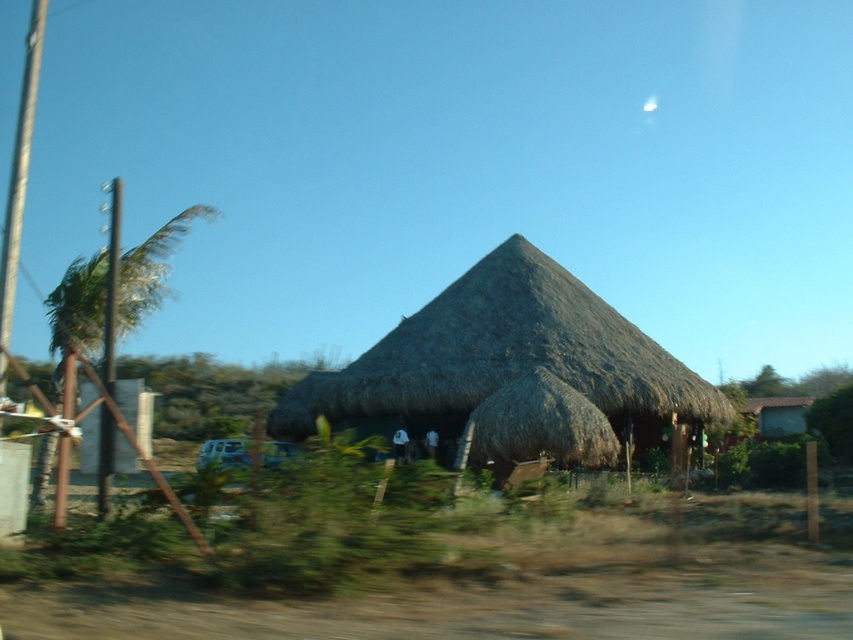
Who is taller, white matte car at lower left or transparent glass car window at center?

Standing taller between the two is white matte car at lower left.

Measure the distance between white matte car at lower left and transparent glass car window at center.

The distance of white matte car at lower left from transparent glass car window at center is 5.07 meters.

The image size is (853, 640). I want to click on white matte car at lower left, so click(x=223, y=456).

Does point (695, 396) lie behind point (218, 449)?

Yes, it is behind point (218, 449).

Locate an element on the screen. thatched roof hut at center is located at coordinates [500, 356].

Is point (409, 323) behind point (218, 449)?

Yes, point (409, 323) is behind point (218, 449).

Find the location of `thatched roof hut at center`. thatched roof hut at center is located at coordinates (500, 356).

Does metallic pole at left lie behind transparent glass car window at center?

That is False.

Is point (109, 435) more distant than point (218, 449)?

No.

Locate an element on the screen. This screenshot has width=853, height=640. metallic pole at left is located at coordinates (111, 288).

The width and height of the screenshot is (853, 640). In order to click on metallic pole at left in this screenshot , I will do `click(111, 288)`.